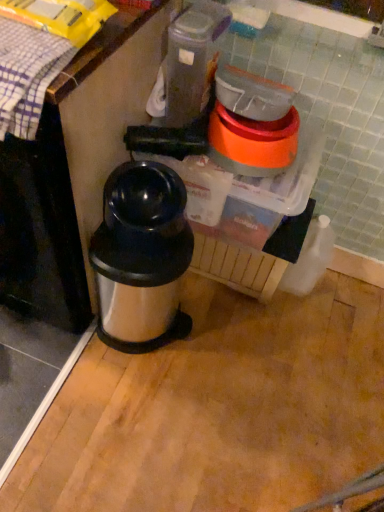
Question: Based on their sizes in the image, would you say plaid fabric at upper left is bigger or smaller than black plastic blender at center?

Choices:
 (A) big
 (B) small

Answer: (B)

Question: Considering the positions of plaid fabric at upper left and black plastic blender at center in the image, is plaid fabric at upper left wider or thinner than black plastic blender at center?

Choices:
 (A) thin
 (B) wide

Answer: (A)

Question: Considering the real-world distances, which object is closest to the silver metallic thermos at center?

Choices:
 (A) plaid fabric at upper left
 (B) black plastic blender at center

Answer: (B)

Question: Estimate the real-world distances between objects in this image. Which object is farther from the black plastic blender at center?

Choices:
 (A) silver metallic thermos at center
 (B) plaid fabric at upper left

Answer: (B)